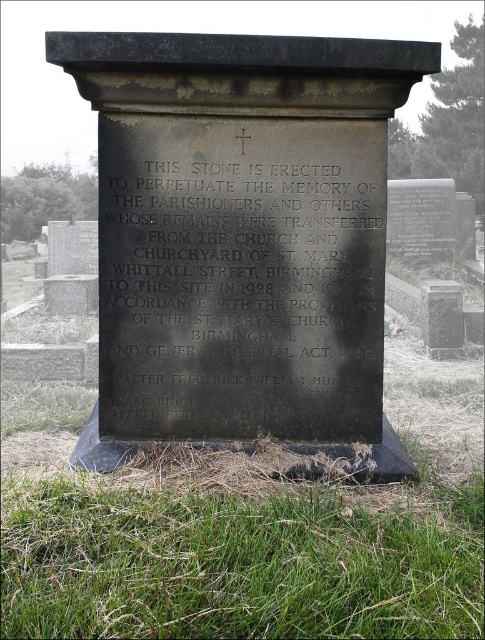
Question: Which object is farther from the camera taking this photo?

Choices:
 (A) black stone monument at center
 (B) smooth gray stone at center
 (C) green grass at lower center

Answer: (B)

Question: Which is nearer to the smooth gray stone at center?

Choices:
 (A) black polished stone plaque at center
 (B) green grass at lower center
 (C) black stone monument at center

Answer: (C)

Question: Can you confirm if black stone monument at center is smaller than black polished stone plaque at center?

Choices:
 (A) yes
 (B) no

Answer: (B)

Question: Estimate the real-world distances between objects in this image. Which object is closer to the green grass at lower center?

Choices:
 (A) black polished stone plaque at center
 (B) black stone monument at center

Answer: (B)

Question: Can you confirm if black stone monument at center is smaller than smooth gray stone at center?

Choices:
 (A) no
 (B) yes

Answer: (A)

Question: Is black stone monument at center to the left of green grass at lower center from the viewer's perspective?

Choices:
 (A) no
 (B) yes

Answer: (B)